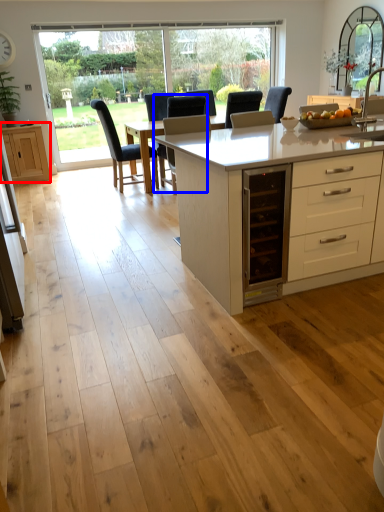
Question: Which object appears farthest to the camera in this image, cabinetry (highlighted by a red box) or chair (highlighted by a blue box)?

Choices:
 (A) cabinetry
 (B) chair

Answer: (A)